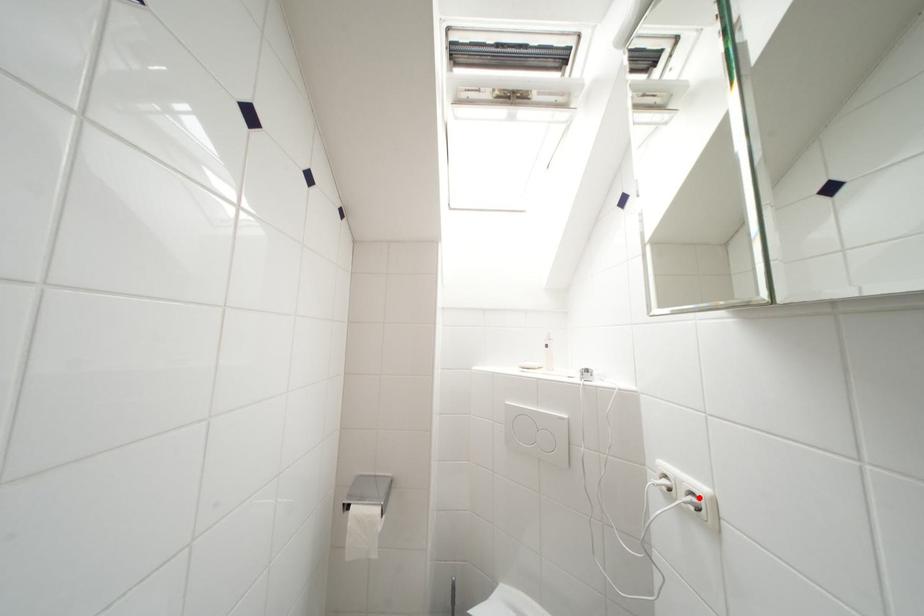
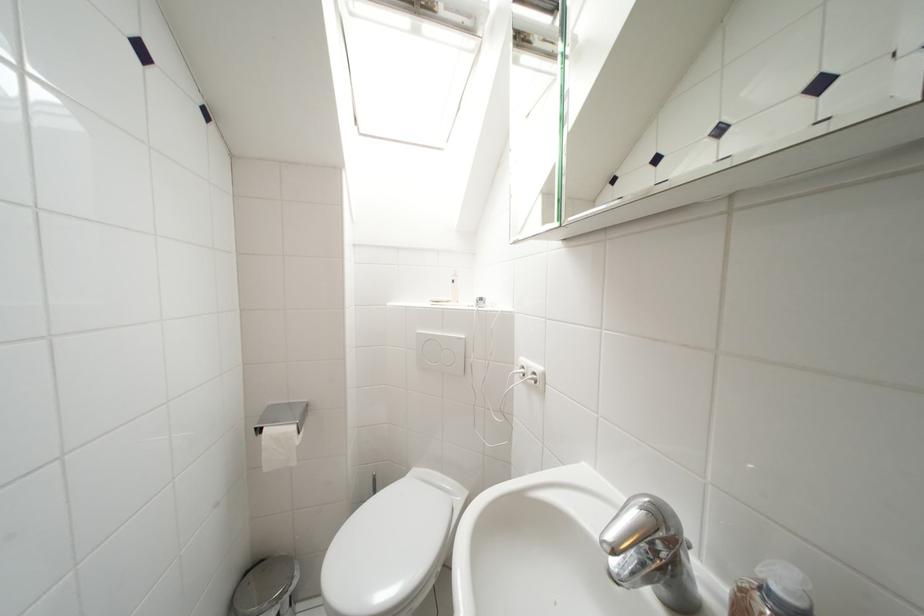
Question: I am providing you with two images of the same scene from different viewpoints. A red point is marked on the first image. Is the red point's position out of view in image 2?

Choices:
 (A) Yes
 (B) No

Answer: (B)